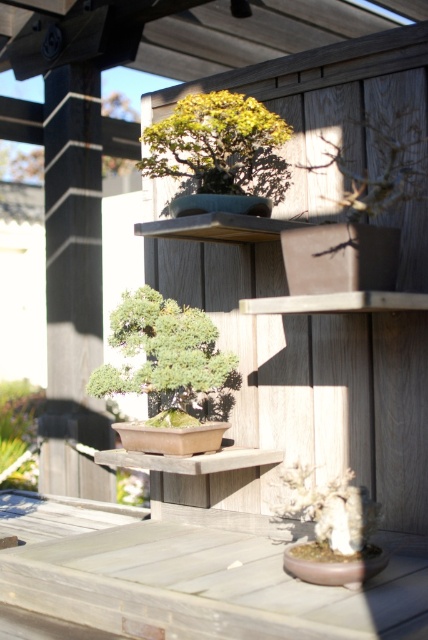
Question: Which point is farther to the camera?

Choices:
 (A) green matte bonsai tree at upper center
 (B) green matte bonsai at lower left

Answer: (B)

Question: Is green matte bonsai tree at center positioned behind white textured rock at center?

Choices:
 (A) yes
 (B) no

Answer: (A)

Question: Is green matte bonsai tree at upper center bigger than green matte bonsai at lower left?

Choices:
 (A) no
 (B) yes

Answer: (A)

Question: Which is farther from the green matte bonsai tree at center?

Choices:
 (A) green matte bonsai tree at upper center
 (B) smooth light wood table at lower center
 (C) green matte bonsai at lower left
 (D) white textured rock at center

Answer: (C)

Question: Which point is closer to the camera?

Choices:
 (A) (145, 356)
 (B) (276, 508)

Answer: (B)

Question: Does green matte bonsai tree at upper center appear on the left side of white textured rock at center?

Choices:
 (A) no
 (B) yes

Answer: (B)